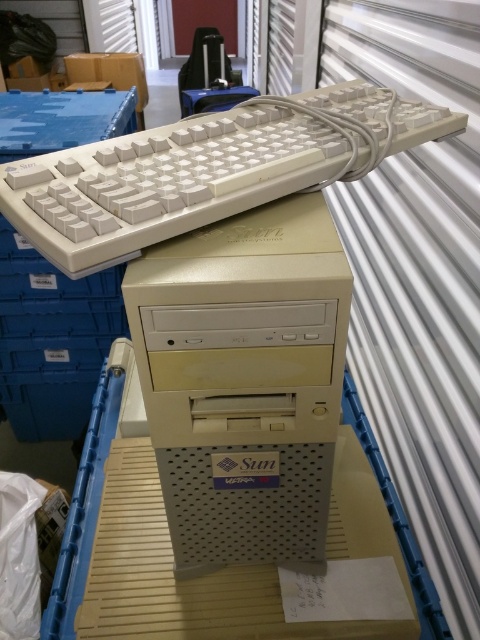
Question: Estimate the real-world distances between objects in this image. Which object is closer to the beige plastic computer tower at center?

Choices:
 (A) white plastic computer desk at center
 (B) white plastic keyboard at upper center

Answer: (B)

Question: Based on their relative distances, which object is nearer to the white plastic computer desk at center?

Choices:
 (A) white plastic keyboard at upper center
 (B) beige plastic computer tower at center

Answer: (B)

Question: Among these points, which one is farthest from the camera?

Choices:
 (A) (60, 220)
 (B) (307, 204)
 (C) (162, 508)

Answer: (C)

Question: Does white plastic keyboard at upper center appear on the right side of white plastic computer desk at center?

Choices:
 (A) no
 (B) yes

Answer: (B)

Question: Considering the relative positions of white plastic keyboard at upper center and white plastic computer desk at center in the image provided, where is white plastic keyboard at upper center located with respect to white plastic computer desk at center?

Choices:
 (A) right
 (B) left

Answer: (A)

Question: Does beige plastic computer tower at center appear on the right side of white plastic computer desk at center?

Choices:
 (A) yes
 (B) no

Answer: (A)